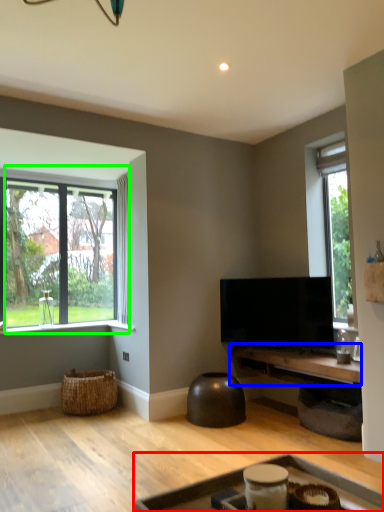
Question: Based on their relative distances, which object is farther from table (highlighted by a red box)? Choose from table (highlighted by a blue box) and window (highlighted by a green box).

Choices:
 (A) table
 (B) window

Answer: (B)